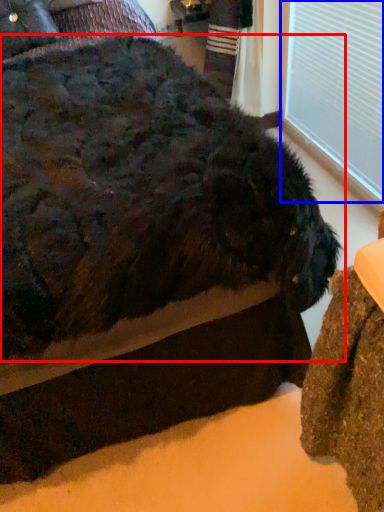
Question: Among these objects, which one is nearest to the camera, dog (highlighted by a red box) or window frame (highlighted by a blue box)?

Choices:
 (A) dog
 (B) window frame

Answer: (A)